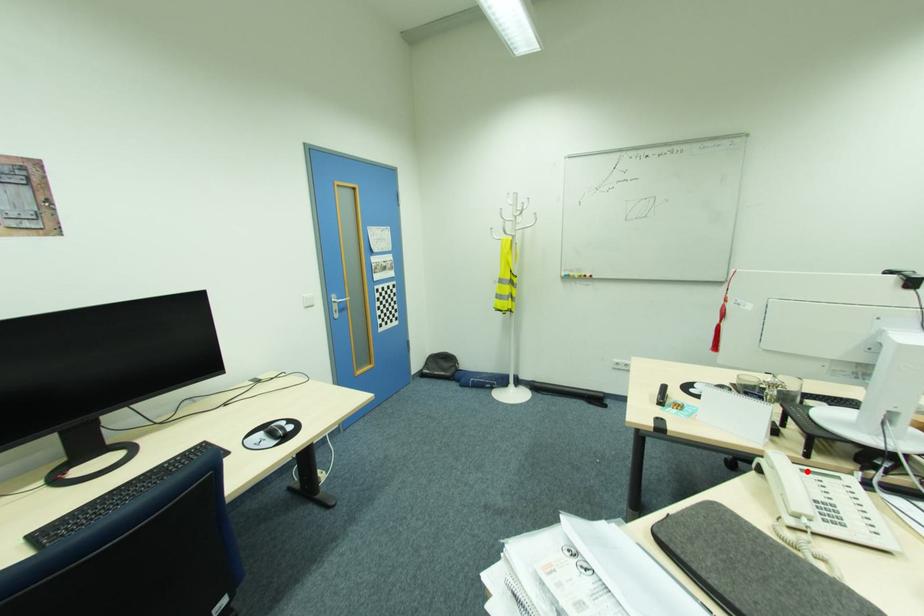
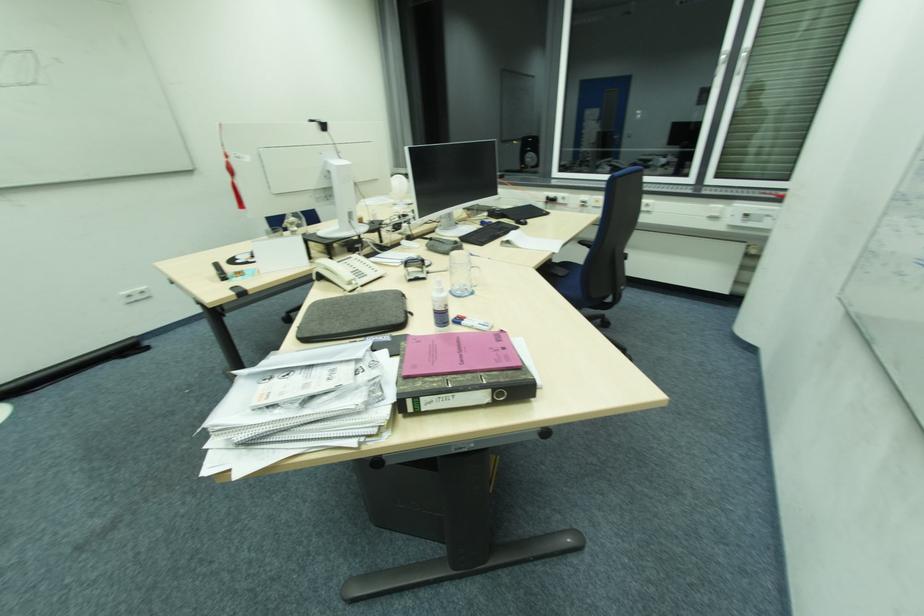
Where in the second image is the point corresponding to the highlighted location from the first image?

(342, 262)